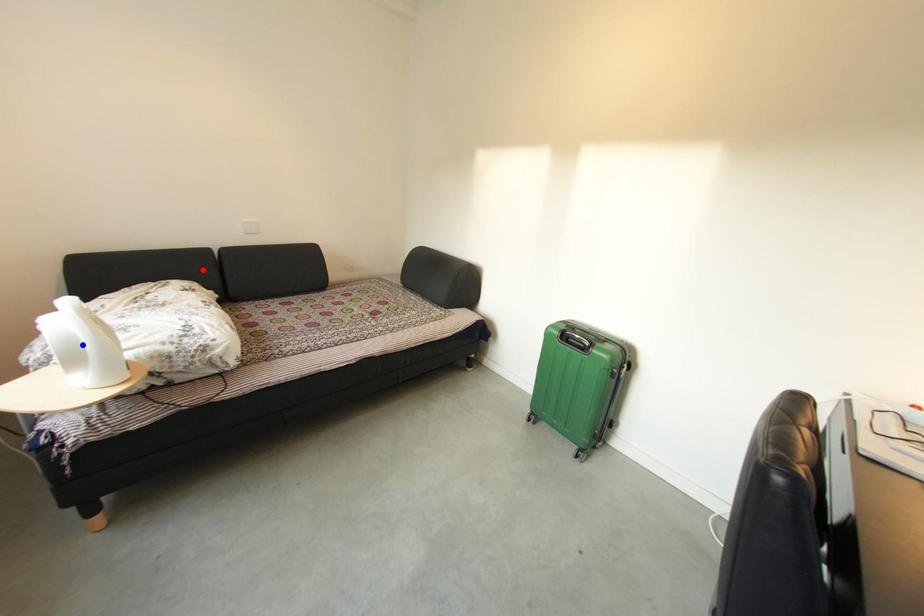
Question: In the image, two points are highlighted. Which point is nearer to the camera? Reply with the corresponding letter.

Choices:
 (A) blue point
 (B) red point

Answer: (A)